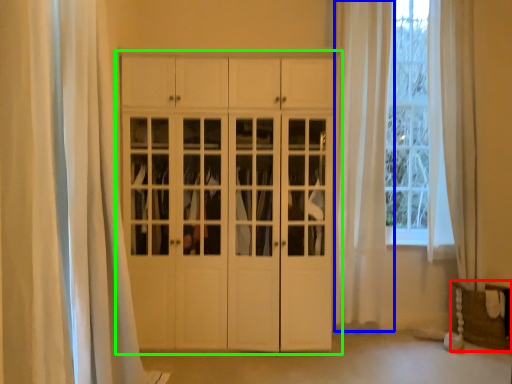
Question: Which object is positioned farthest from furniture (highlighted by a red box)? Select from curtain (highlighted by a blue box) and cupboard (highlighted by a green box).

Choices:
 (A) curtain
 (B) cupboard

Answer: (B)